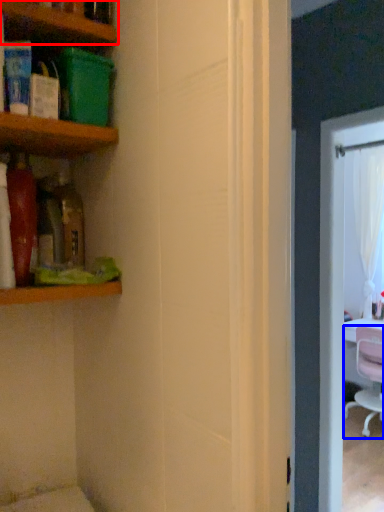
Question: Which object is closer to the camera taking this photo, shelf (highlighted by a red box) or chair (highlighted by a blue box)?

Choices:
 (A) shelf
 (B) chair

Answer: (A)